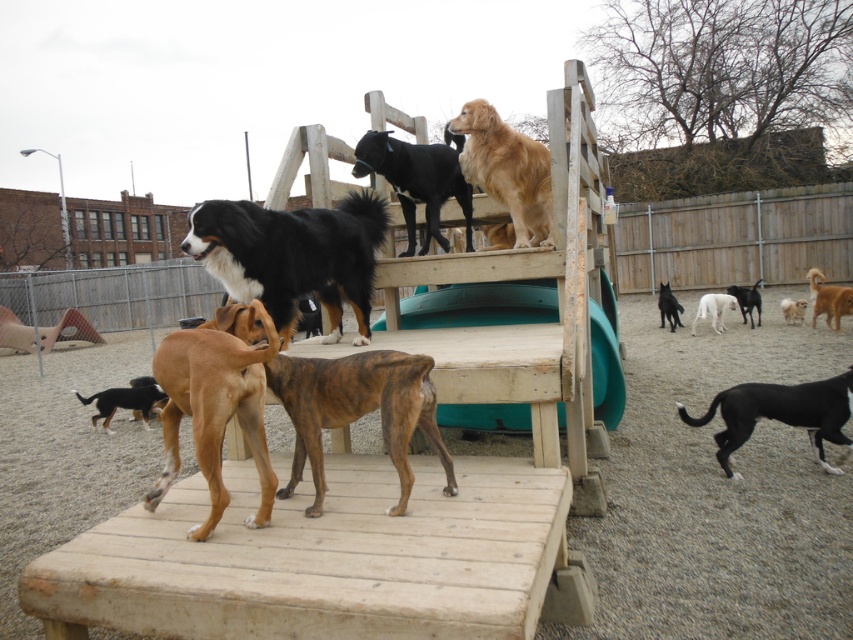
Question: Where is black fur at center located in relation to brown fur dog at center in the image?

Choices:
 (A) below
 (B) above

Answer: (B)

Question: Which object appears closest to the camera in this image?

Choices:
 (A) black smooth dog at lower right
 (B) black glossy dog at upper center
 (C) golden brown fur at upper right

Answer: (A)

Question: Can you confirm if brown brindle dog at center is thinner than black and tan fur at lower left?

Choices:
 (A) no
 (B) yes

Answer: (B)

Question: Is black fur at center positioned at the back of brown brindle dog at center?

Choices:
 (A) yes
 (B) no

Answer: (A)

Question: Which point is closer to the camera?

Choices:
 (A) brown brindle dog at center
 (B) black smooth dog at center

Answer: (A)

Question: Estimate the real-world distances between objects in this image. Which object is farther from the wooden fence at right?

Choices:
 (A) brown fur dog at center
 (B) wooden ramp at center

Answer: (B)